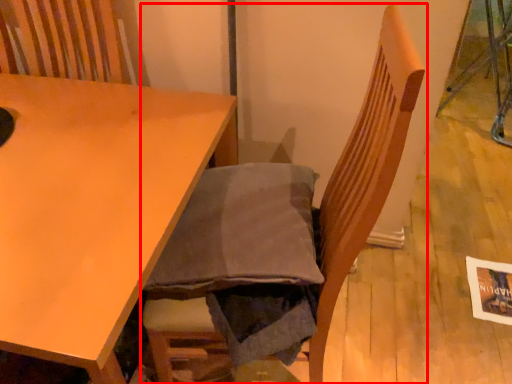
Question: Where is chair (annotated by the red box) located in relation to table in the image?

Choices:
 (A) left
 (B) right

Answer: (B)